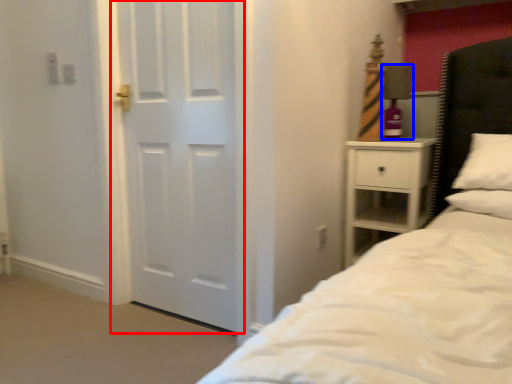
Question: Which of the following is the farthest to the observer, door (highlighted by a red box) or lamp (highlighted by a blue box)?

Choices:
 (A) door
 (B) lamp

Answer: (B)